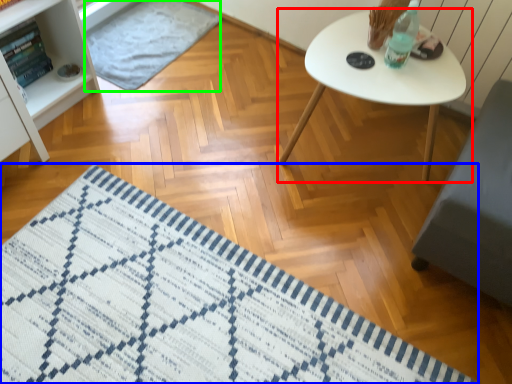
Question: Considering the real-world distances, which object is farthest from table (highlighted by a red box)? mat (highlighted by a blue box) or mat (highlighted by a green box)?

Choices:
 (A) mat
 (B) mat

Answer: (B)